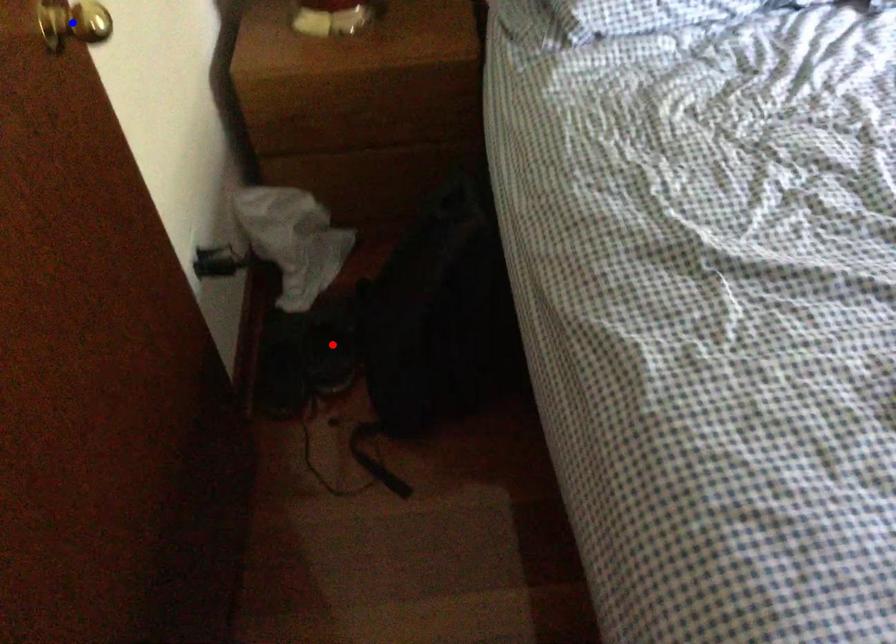
Question: Two points are marked on the image. Which point is closer to the camera?

Choices:
 (A) Blue point is closer.
 (B) Red point is closer.

Answer: (A)